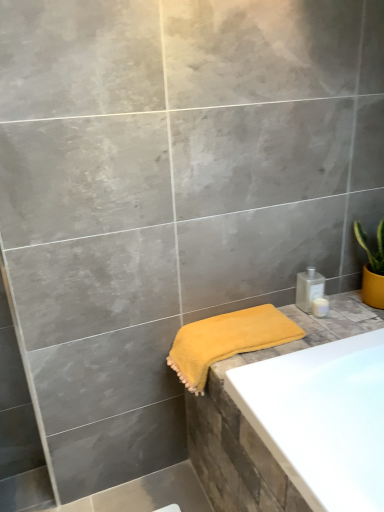
Find the location of a particular element. free space in front of satin silver bottle at right, the 2th toiletry when ordered from bottom to top is located at coordinates (318, 328).